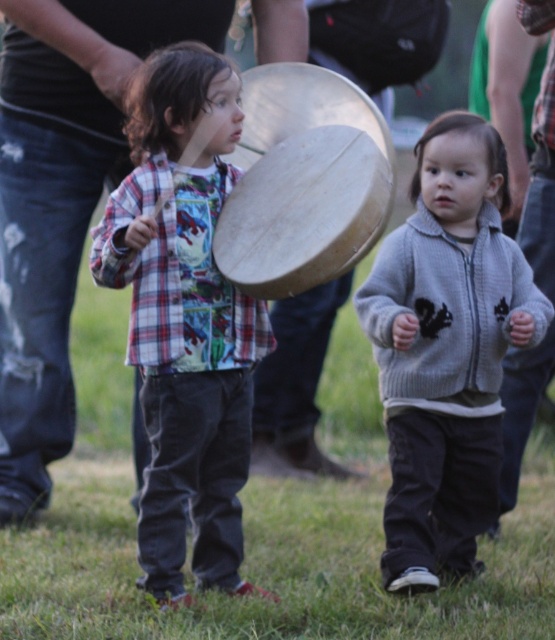
Question: From the image, what is the correct spatial relationship of gray knitted sweater at center in relation to wooden tambourine at center?

Choices:
 (A) right
 (B) left

Answer: (A)

Question: Does plaid shirt at center have a greater width compared to wooden tambourine at center?

Choices:
 (A) no
 (B) yes

Answer: (A)

Question: Which point is closer to the camera?

Choices:
 (A) plaid shirt at center
 (B) wooden tambourine at center

Answer: (A)

Question: Among these objects, which one is farthest from the camera?

Choices:
 (A) gray knitted sweater at center
 (B) wooden tambourine at center
 (C) plaid shirt at center

Answer: (A)

Question: Is gray knitted sweater at center thinner than wooden tambourine at center?

Choices:
 (A) yes
 (B) no

Answer: (B)

Question: Among these points, which one is farthest from the camera?

Choices:
 (A) (296, 147)
 (B) (228, 588)
 (C) (453, 394)

Answer: (C)